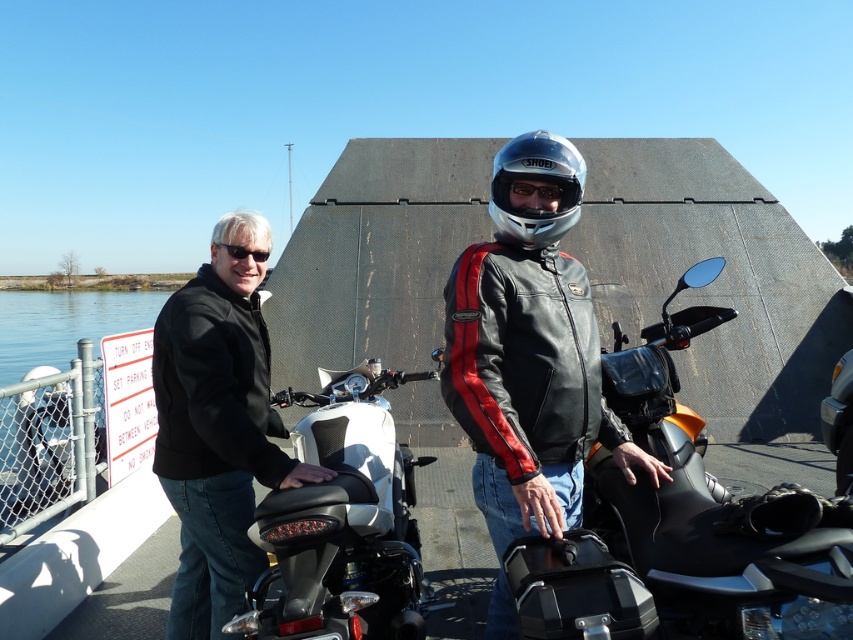
Question: Is silver metallic helmet at center bigger than black plastic goggles at upper left?

Choices:
 (A) yes
 (B) no

Answer: (A)

Question: Does black leather jacket at center appear on the right side of silver metallic helmet at center?

Choices:
 (A) yes
 (B) no

Answer: (A)

Question: Which object is the farthest from the silver metallic helmet at center?

Choices:
 (A) white matte seat at center
 (B) orange matte/black textured seat at center
 (C) black leather jacket at left

Answer: (C)

Question: Which point is closer to the camera taking this photo?

Choices:
 (A) (688, 477)
 (B) (244, 253)

Answer: (B)

Question: Does black leather jacket at center have a lesser width compared to orange matte/black textured seat at center?

Choices:
 (A) no
 (B) yes

Answer: (A)

Question: Which point is closer to the camera?

Choices:
 (A) orange matte/black textured seat at center
 (B) black plastic goggles at upper left

Answer: (A)